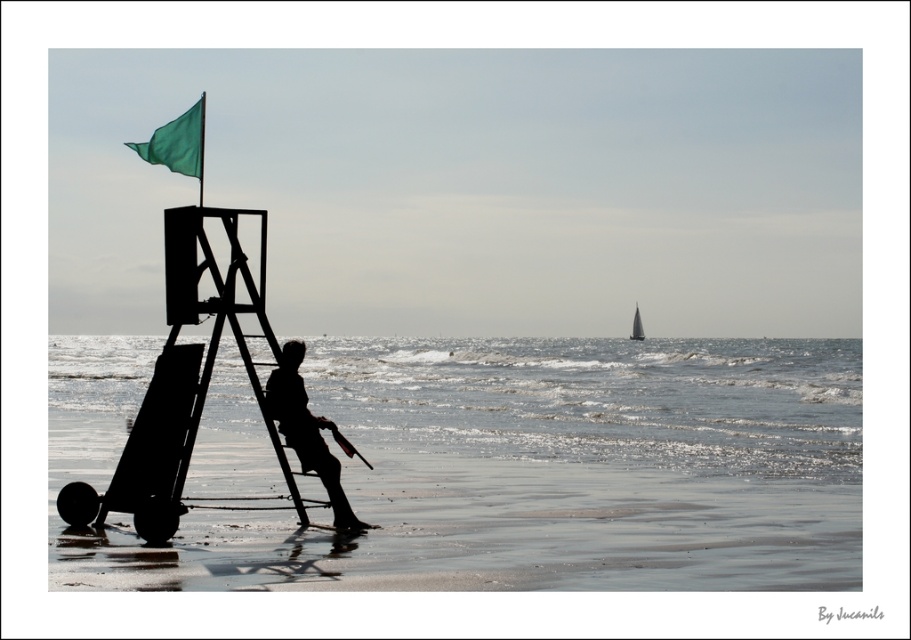
You are standing at the beach and see the silhouette wood person at center. If you want to walk directly towards them, which direction should you head?

The silhouette wood person at center is located at point coordinates, so you should walk towards the center of the image to reach them.

You are a photographer trying to capture the silhouette of the wood person and the green flag in the same frame. Given that the silhouette wood person at center is narrower than the green fabric flag at upper left, which object would appear wider in your photo?

The green fabric flag at upper left would appear wider in the photo since it has a greater width compared to the silhouette wood person at center.

You are a swimmer who wants to reach the silhouette wood person at center from the clear water at center. Given that you can swim at 1.5 meters per second, how long will it take you to reach them?

The distance between the clear water at center and the silhouette wood person at center is 49.07 meters. At a swimming speed of 1.5 meters per second, it would take approximately 32.7 seconds to reach them.